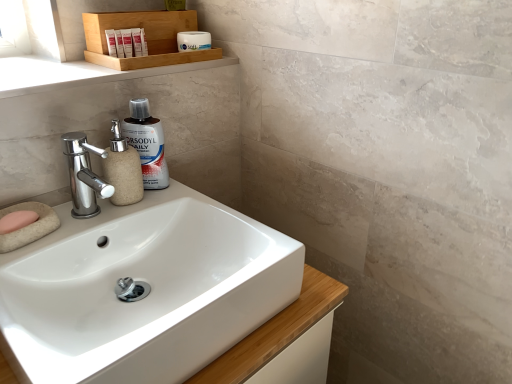
This screenshot has width=512, height=384. Find the location of `vacant space situated on the left part of matte white tube at upper left, which is counted as the 3th toiletry, starting from the right`. vacant space situated on the left part of matte white tube at upper left, which is counted as the 3th toiletry, starting from the right is located at coordinates (48, 64).